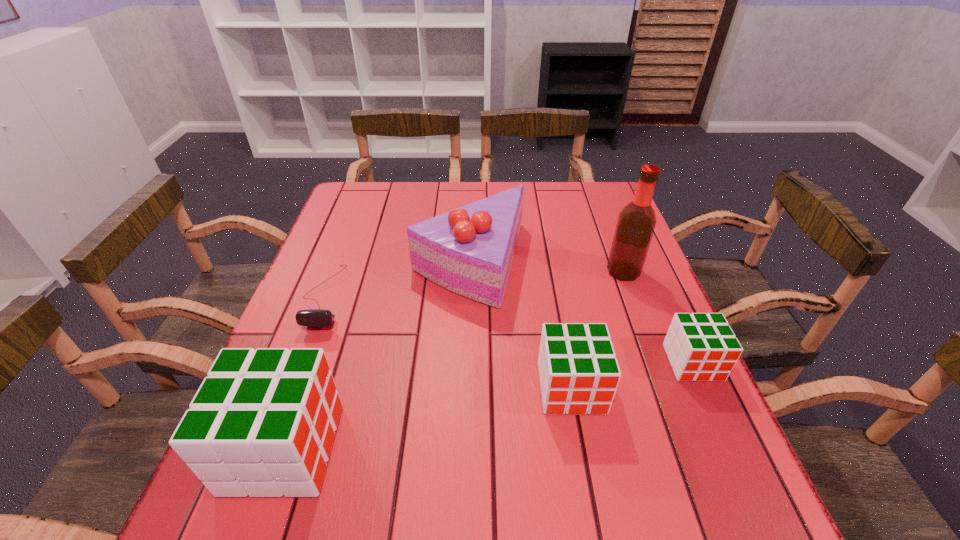
Where is `vacant space at the far edge of the desktop`? The image size is (960, 540). vacant space at the far edge of the desktop is located at coordinates (447, 188).

Locate an element on the screen. Image resolution: width=960 pixels, height=540 pixels. blank space at the near edge of the desktop is located at coordinates (536, 441).

This screenshot has width=960, height=540. In the image, there is a desktop. Identify the location of free space at the left edge. (348, 236).

You are a GUI agent. You are given a task and a screenshot of the screen. Output one action in this format:
    pyautogui.click(x=<x>, y=<y>)
    Task: Click on the vacant space at the right edge of the desktop
    This screenshot has width=960, height=540.
    Given the screenshot: What is the action you would take?
    pyautogui.click(x=575, y=225)

The height and width of the screenshot is (540, 960). What are the coordinates of `free space at the far right corner` in the screenshot? It's located at (579, 183).

The image size is (960, 540). What are the coordinates of `vacant point located between the shortest cube and the beer bottle` in the screenshot? It's located at (658, 317).

You are a GUI agent. You are given a task and a screenshot of the screen. Output one action in this format:
    pyautogui.click(x=<x>, y=<y>)
    Task: Click on the blank region between the webcam and the second cube from left to right
    This screenshot has width=960, height=540.
    Given the screenshot: What is the action you would take?
    pyautogui.click(x=448, y=342)

Locate an element on the screen. free space between the webcam and the rightmost cube is located at coordinates (509, 329).

Image resolution: width=960 pixels, height=540 pixels. Identify the location of free space between the cake and the tallest object. (546, 267).

The width and height of the screenshot is (960, 540). In order to click on free point between the second tallest cube and the leftmost cube in this screenshot , I will do `click(427, 418)`.